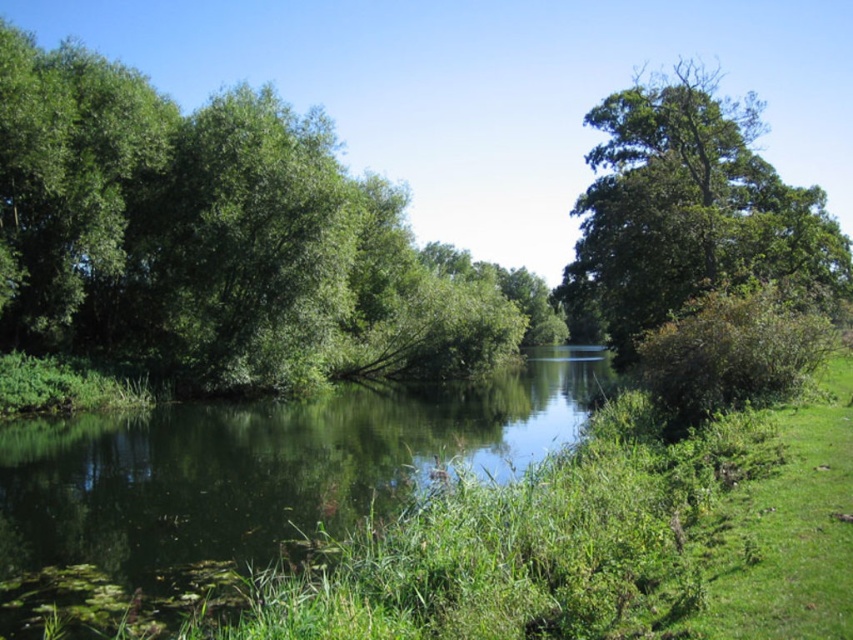
Is green leafy tree at left closer to camera compared to green grassy river at center?

No, it is not.

Can you confirm if green leafy tree at left is smaller than green grassy river at center?

No, green leafy tree at left is not smaller than green grassy river at center.

Where is `green leafy tree at left`? This screenshot has height=640, width=853. green leafy tree at left is located at coordinates (221, 241).

Does green grassy river at center come behind green leafy tree at upper right?

No, it is in front of green leafy tree at upper right.

Which is more to the right, green grassy river at center or green leafy tree at upper right?

green leafy tree at upper right

What do you see at coordinates (262, 468) in the screenshot?
I see `green grassy river at center` at bounding box center [262, 468].

What are the coordinates of `green grassy river at center` in the screenshot? It's located at (262, 468).

Which is below, green leafy tree at left or green leafy tree at upper right?

Positioned lower is green leafy tree at left.

Which is more to the left, green leafy tree at left or green leafy tree at upper right?

green leafy tree at left

Is point (547, 323) farther from camera compared to point (641, 300)?

Yes.

Where is `green leafy tree at left`? The image size is (853, 640). green leafy tree at left is located at coordinates point(221,241).